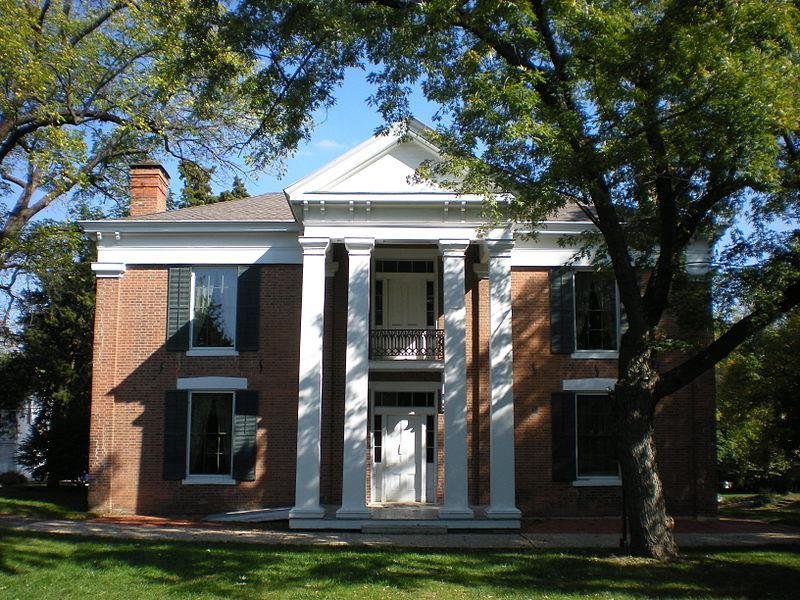
Locate an element on the screen. This screenshot has height=600, width=800. shutter is located at coordinates (178, 429).